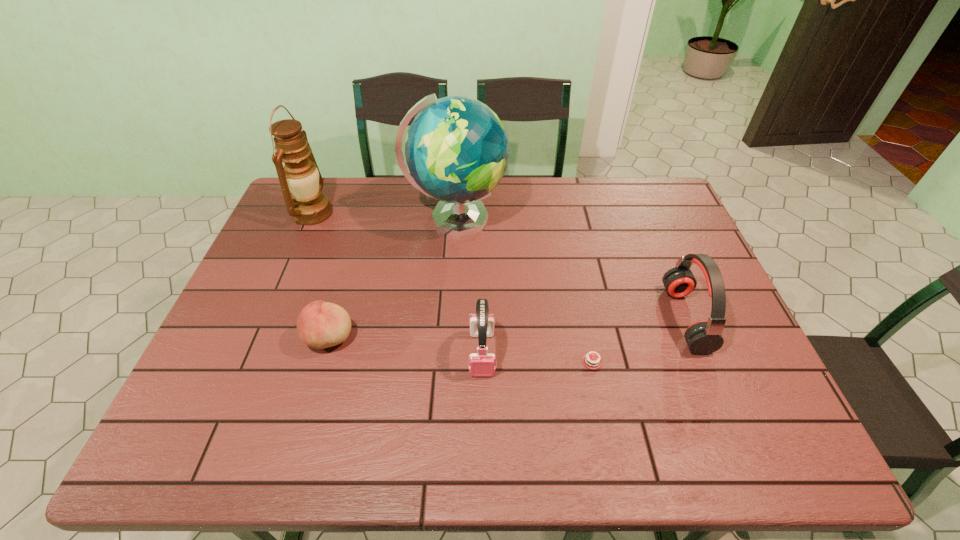
Locate an element on the screen. Image resolution: width=960 pixels, height=540 pixels. free space that satisfies the following two spatial constraints: 1. on the ear cups of the right earphone; 2. on the outer surface of the left earphone is located at coordinates (700, 354).

Locate an element on the screen. The image size is (960, 540). free space that satisfies the following two spatial constraints: 1. on the ear cups of the rightmost object; 2. on the outer surface of the left earphone is located at coordinates (700, 354).

This screenshot has height=540, width=960. Find the location of `vacant point that satisfies the following two spatial constraints: 1. on the ear cups of the right earphone; 2. on the front side of the peach`. vacant point that satisfies the following two spatial constraints: 1. on the ear cups of the right earphone; 2. on the front side of the peach is located at coordinates (693, 338).